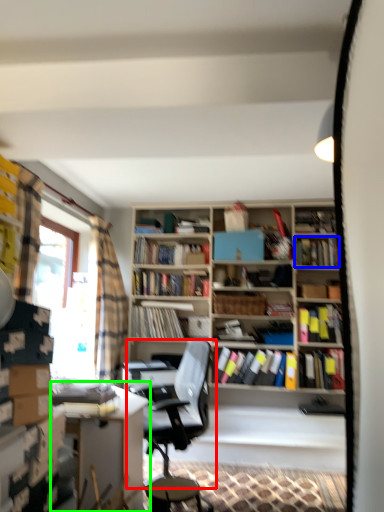
Question: Which is nearer to the chair (highlighted by a red box)? book (highlighted by a blue box) or table (highlighted by a green box).

Choices:
 (A) book
 (B) table

Answer: (B)